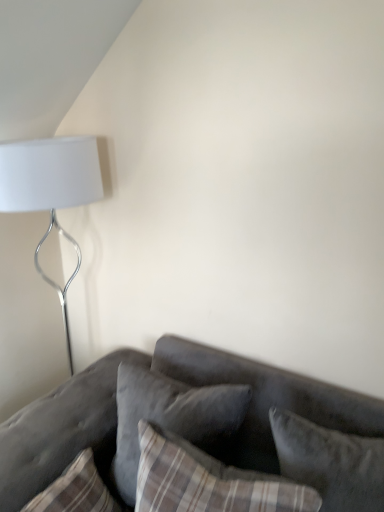
Question: Is velvet gray couch at lower right to the left of plaid fabric pillow at lower left, which ranks as the third pillow in right-to-left order, from the viewer's perspective?

Choices:
 (A) no
 (B) yes

Answer: (A)

Question: Does velvet gray couch at lower right have a greater width compared to plaid fabric pillow at lower left, which is the first pillow from left to right?

Choices:
 (A) no
 (B) yes

Answer: (B)

Question: From the image's perspective, would you say velvet gray couch at lower right is shown under plaid fabric pillow at lower left, which ranks as the third pillow in right-to-left order?

Choices:
 (A) yes
 (B) no

Answer: (A)

Question: Could you tell me if velvet gray couch at lower right is facing plaid fabric pillow at lower left, which is the first pillow from left to right?

Choices:
 (A) yes
 (B) no

Answer: (A)

Question: Is the depth of velvet gray couch at lower right greater than that of plaid fabric pillow at lower left, which is the first pillow from left to right?

Choices:
 (A) no
 (B) yes

Answer: (A)

Question: Is point (331, 502) positioned closer to the camera than point (175, 393)?

Choices:
 (A) farther
 (B) closer

Answer: (B)

Question: Considering the positions of velvet gray pillow at lower right, acting as the first pillow starting from the right, and velvet gray pillow at center, arranged as the 2th pillow when viewed from the right, in the image, is velvet gray pillow at lower right, acting as the first pillow starting from the right, wider or thinner than velvet gray pillow at center, arranged as the 2th pillow when viewed from the right,?

Choices:
 (A) thin
 (B) wide

Answer: (B)

Question: From a real-world perspective, is velvet gray pillow at lower right, the third pillow viewed from the left, above or below velvet gray pillow at center, marked as the second pillow in a left-to-right arrangement?

Choices:
 (A) above
 (B) below

Answer: (A)

Question: Considering the relative positions of velvet gray pillow at lower right, the third pillow viewed from the left, and velvet gray pillow at center, marked as the second pillow in a left-to-right arrangement, in the image provided, is velvet gray pillow at lower right, the third pillow viewed from the left, to the left or to the right of velvet gray pillow at center, marked as the second pillow in a left-to-right arrangement,?

Choices:
 (A) left
 (B) right

Answer: (B)

Question: Considering their positions, is white matte lamp at upper left located in front of or behind velvet gray pillow at center, marked as the second pillow in a left-to-right arrangement?

Choices:
 (A) behind
 (B) front

Answer: (A)

Question: Based on their positions, is white matte lamp at upper left located to the left or right of velvet gray pillow at center, marked as the second pillow in a left-to-right arrangement?

Choices:
 (A) left
 (B) right

Answer: (A)

Question: Is point (79, 253) positioned closer to the camera than point (203, 439)?

Choices:
 (A) closer
 (B) farther

Answer: (B)

Question: Is white matte lamp at upper left wider or thinner than velvet gray pillow at center, arranged as the 2th pillow when viewed from the right?

Choices:
 (A) thin
 (B) wide

Answer: (B)

Question: From the image's perspective, is white matte lamp at upper left positioned above or below velvet gray pillow at lower right, the third pillow viewed from the left?

Choices:
 (A) above
 (B) below

Answer: (A)

Question: Is white matte lamp at upper left to the left or to the right of velvet gray pillow at lower right, the third pillow viewed from the left, in the image?

Choices:
 (A) left
 (B) right

Answer: (A)